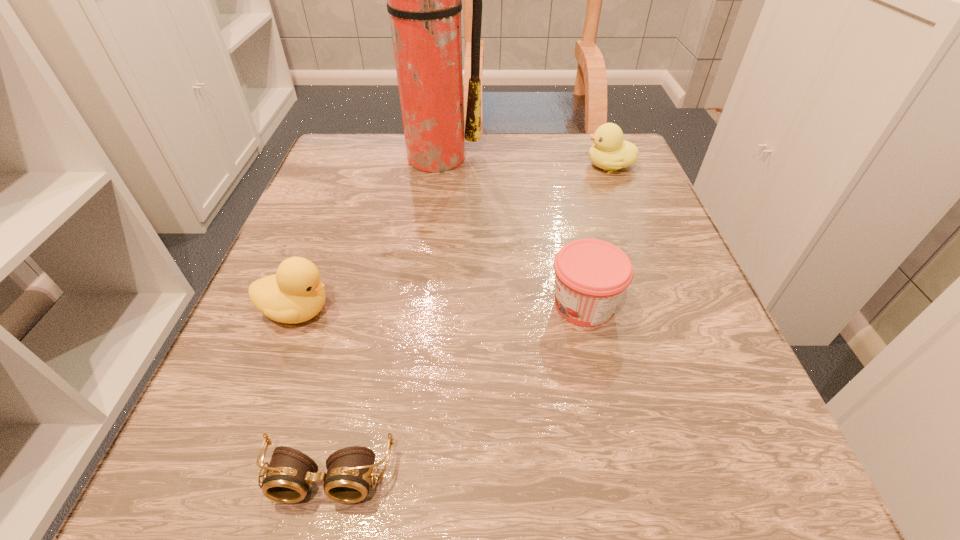
The height and width of the screenshot is (540, 960). Find the location of `fire extinguisher`. fire extinguisher is located at coordinates (424, 0).

Locate an element on the screen. The image size is (960, 540). duck is located at coordinates (295, 294).

This screenshot has height=540, width=960. In order to click on the rightmost object in this screenshot , I will do [x=610, y=152].

Image resolution: width=960 pixels, height=540 pixels. Identify the location of the fourth object from left to right. (591, 275).

The image size is (960, 540). I want to click on the shortest object, so click(x=288, y=478).

What are the coordinates of `the nearest object` in the screenshot? It's located at (288, 478).

Locate an element on the screen. free spot located 0.330m at the nozzle of the tallest object is located at coordinates (414, 284).

I want to click on blank area located on the front-facing side of the duck, so click(x=589, y=311).

You are a GUI agent. You are given a task and a screenshot of the screen. Output one action in this format:
    pyautogui.click(x=<x>, y=<y>)
    Task: Click on the free space located 0.260m at the beak of the duckling
    
    Given the screenshot: What is the action you would take?
    pyautogui.click(x=466, y=166)

Find the location of a particular element. vacant space located at the beak of the duckling is located at coordinates (498, 166).